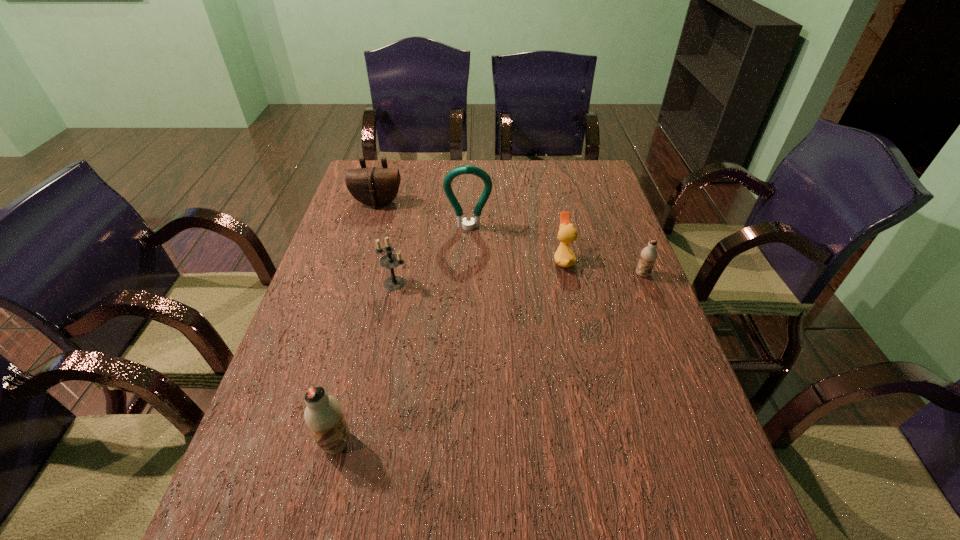
Identify the location of vacant point located between the pouch and the second object from right to left. The height and width of the screenshot is (540, 960). point(470,231).

Find the location of `free space between the shorter chocolate milk and the second object from right to left`. free space between the shorter chocolate milk and the second object from right to left is located at coordinates (603, 267).

This screenshot has width=960, height=540. Identify the location of free space between the nearer chocolate milk and the shorter chocolate milk. (490, 359).

Locate an element on the screen. This screenshot has width=960, height=540. empty space between the fourth object from left to right and the nearest object is located at coordinates (402, 335).

The image size is (960, 540). I want to click on free point between the second object from right to left and the candle holder, so click(479, 272).

Where is `vacant space that is in between the taller chocolate milk and the farthest object`? vacant space that is in between the taller chocolate milk and the farthest object is located at coordinates (357, 323).

Where is `empty location between the second object from right to left and the candle holder`? empty location between the second object from right to left and the candle holder is located at coordinates (479, 272).

The image size is (960, 540). I want to click on object that is the fifth closest to the pouch, so click(x=323, y=414).

Identify which object is the fifth nearest to the farthest object. Please provide its 2D coordinates. Your answer should be formatted as a tuple, i.e. [(x, y)], where the tuple contains the x and y coordinates of a point satisfying the conditions above.

[(323, 414)]

I want to click on blank space that satisfies the following two spatial constraints: 1. at the jaws of the fourth object from left to right; 2. on the left side of the shorter chocolate milk, so click(x=468, y=274).